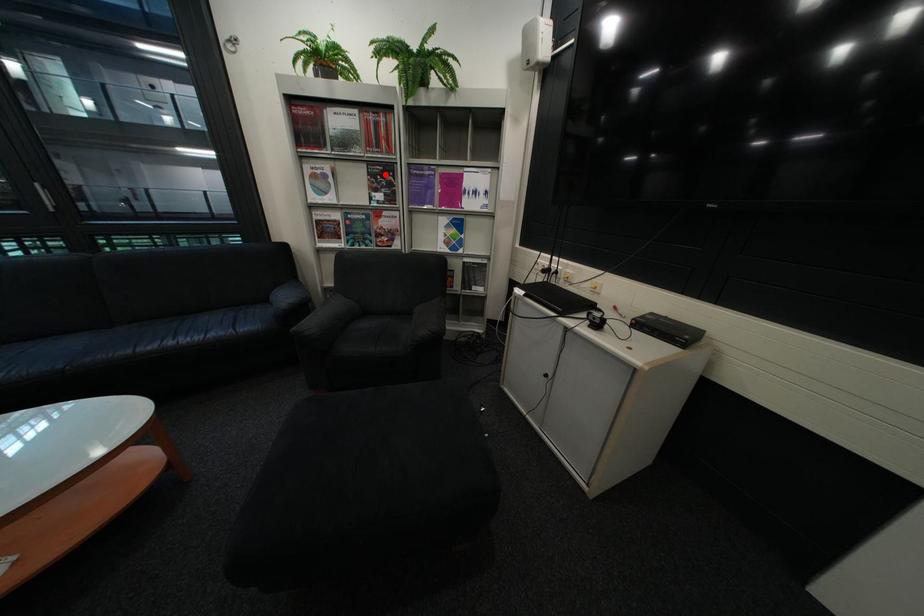
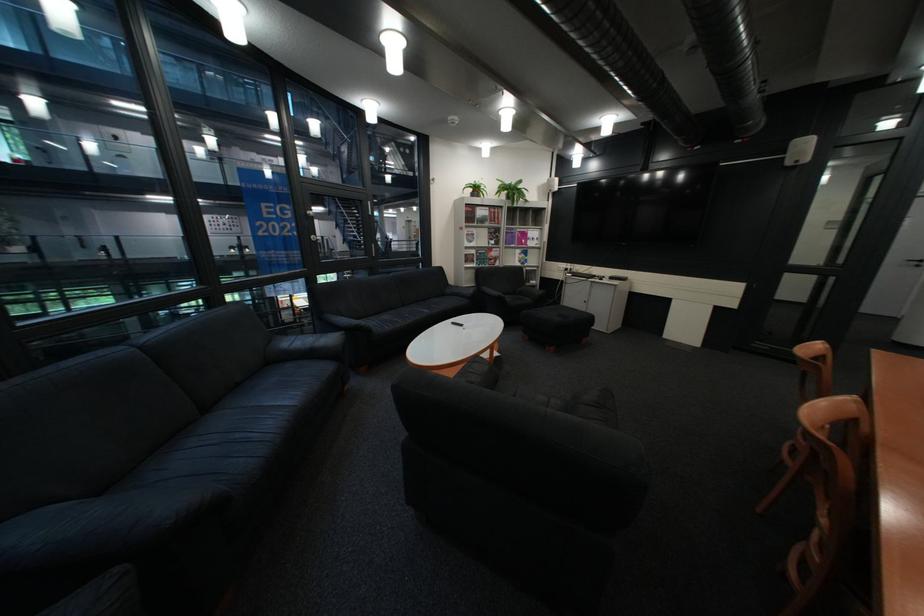
Locate, in the second image, the point that corresponds to the highlighted location in the first image.

(505, 233)